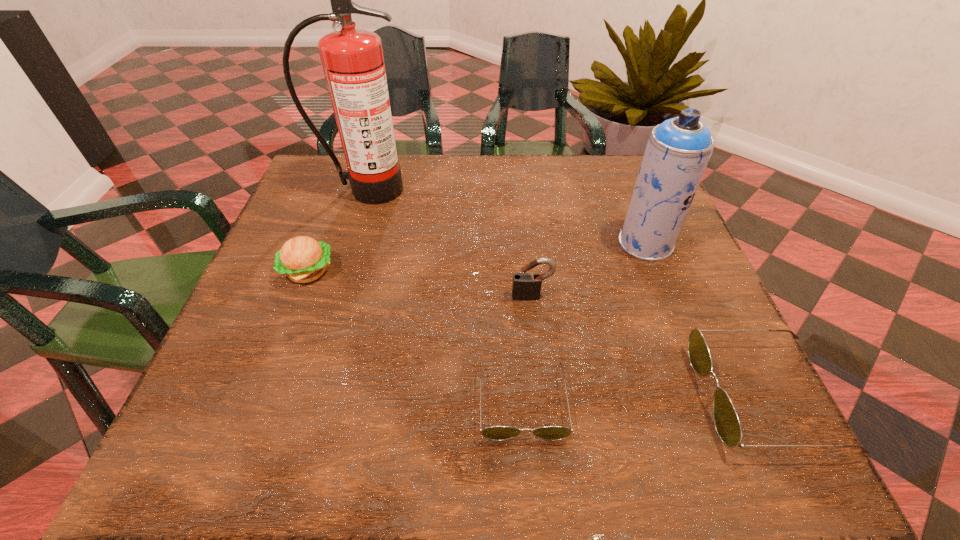
You are a GUI agent. You are given a task and a screenshot of the screen. Output one action in this format:
    pyautogui.click(x=<x>, y=<y>)
    Task: Click on the sunglasses that is at the right edge
    Image resolution: width=960 pixels, height=540 pixels.
    Given the screenshot: What is the action you would take?
    pyautogui.click(x=726, y=421)

The width and height of the screenshot is (960, 540). Identify the location of aerosol can located at the right edge. tap(678, 150).

Find the location of `object that is at the far left corner`. object that is at the far left corner is located at coordinates (352, 59).

This screenshot has width=960, height=540. What are the coordinates of `object that is at the near right corner` in the screenshot? It's located at (726, 421).

The image size is (960, 540). I want to click on blank area at the far edge, so click(475, 170).

Find the location of a particular element. This screenshot has width=960, height=540. vacant space at the near edge is located at coordinates (535, 397).

In the image, there is a desktop. Identify the location of vacant space at the left edge. The width and height of the screenshot is (960, 540). (343, 252).

Locate an element on the screen. The image size is (960, 540). vacant region at the right edge of the desktop is located at coordinates (682, 359).

In the image, there is a desktop. Where is `free space at the far left corner`? free space at the far left corner is located at coordinates (321, 205).

At what (x,y) coordinates should I click in order to perform the action: click on free space at the far right corner. Please return your answer as a coordinate pair (x, y). Looking at the image, I should click on (625, 199).